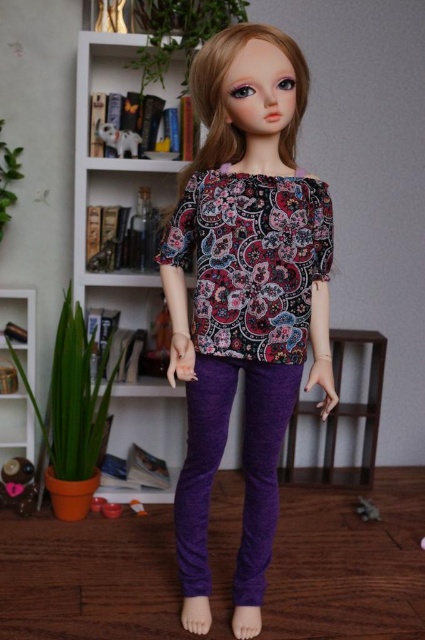
Who is positioned more to the left, matte floral blouse at center or purple fabric stool at center?

matte floral blouse at center

What do you see at coordinates (244, 296) in the screenshot? The width and height of the screenshot is (425, 640). I see `matte floral blouse at center` at bounding box center [244, 296].

Who is more distant from viewer, (207, 310) or (295, 429)?

Positioned behind is point (295, 429).

Locate an element on the screen. matte floral blouse at center is located at coordinates (244, 296).

Does floral-patterned fabric blouse at center appear on the left side of purple fabric stool at center?

Correct, you'll find floral-patterned fabric blouse at center to the left of purple fabric stool at center.

Identify the location of floral-patterned fabric blouse at center. coord(252,260).

Is matte floral blouse at center below matte white bookshelf at left?

Incorrect, matte floral blouse at center is not positioned below matte white bookshelf at left.

Does point (243, 346) come behind point (34, 388)?

That is False.

Where is `matte floral blouse at center`? matte floral blouse at center is located at coordinates (244, 296).